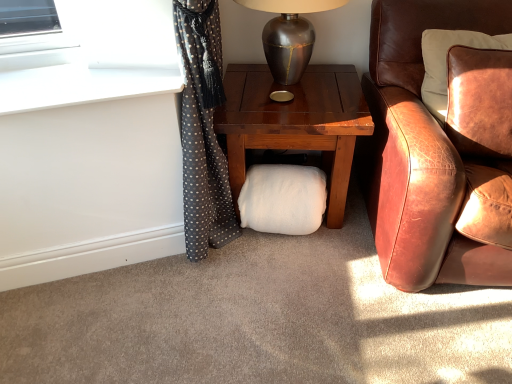
Where is `metallic silver table lamp at upper center`? The height and width of the screenshot is (384, 512). metallic silver table lamp at upper center is located at coordinates (289, 35).

This screenshot has height=384, width=512. What do you see at coordinates (283, 199) in the screenshot? I see `white fluffy pillow at center` at bounding box center [283, 199].

Image resolution: width=512 pixels, height=384 pixels. Identify the location of wooden nightstand at center. (295, 122).

The image size is (512, 384). Describe the element at coordinates (446, 62) in the screenshot. I see `leather pillow at right` at that location.

Locate an element on the screen. The height and width of the screenshot is (384, 512). white smooth window sill at upper left is located at coordinates (80, 86).

I want to click on metallic silver table lamp at upper center, so click(x=289, y=35).

Is wooden nightstand at center placed right next to brown leather chair at right?

No, wooden nightstand at center is not touching brown leather chair at right.

Can you confirm if wooden nightstand at center is bigger than brown leather chair at right?

No.

In the image, there is a brown leather chair at right. Identify the location of nightstand below it (from a real-world perspective). Image resolution: width=512 pixels, height=384 pixels. (295, 122).

Is wooden nightstand at center thinner than brown leather chair at right?

Yes.

Considering the positions of objects metallic silver table lamp at upper center and wooden nightstand at center in the image provided, who is more to the right, metallic silver table lamp at upper center or wooden nightstand at center?

From the viewer's perspective, wooden nightstand at center appears more on the right side.

Does metallic silver table lamp at upper center have a lesser height compared to wooden nightstand at center?

Correct, metallic silver table lamp at upper center is not as tall as wooden nightstand at center.

In the scene shown: Would you consider metallic silver table lamp at upper center to be distant from wooden nightstand at center?

They are positioned close to each other.

Does metallic silver table lamp at upper center have a larger size compared to wooden nightstand at center?

No, metallic silver table lamp at upper center is not bigger than wooden nightstand at center.

Looking at this image, is brown leather chair at right wider than leather pillow at right?

Correct, the width of brown leather chair at right exceeds that of leather pillow at right.

Does brown leather chair at right have a smaller size compared to leather pillow at right?

No, brown leather chair at right is not smaller than leather pillow at right.

Is brown leather chair at right aimed at leather pillow at right?

Yes, brown leather chair at right is facing leather pillow at right.

Is brown leather chair at right not close to leather pillow at right?

No, brown leather chair at right is in close proximity to leather pillow at right.

Which of these two, white smooth window sill at upper left or white fluffy pillow at center, is smaller?

white smooth window sill at upper left is smaller.

Is white smooth window sill at upper left looking in the opposite direction of white fluffy pillow at center?

white smooth window sill at upper left does not have its back to white fluffy pillow at center.

The width and height of the screenshot is (512, 384). What are the coordinates of `window sill on the left side of white fluffy pillow at center` in the screenshot? It's located at (80, 86).

How distant is white smooth window sill at upper left from white fluffy pillow at center?

white smooth window sill at upper left and white fluffy pillow at center are 26.64 inches apart.

From the image's perspective, does brown leather chair at right appear higher than metallic silver table lamp at upper center?

Incorrect, from the image's perspective, brown leather chair at right is lower than metallic silver table lamp at upper center.

Is brown leather chair at right next to metallic silver table lamp at upper center and touching it?

No.

Who is bigger, brown leather chair at right or metallic silver table lamp at upper center?

With larger size is brown leather chair at right.

Is brown leather chair at right not within metallic silver table lamp at upper center?

Yes, brown leather chair at right is not within metallic silver table lamp at upper center.

In terms of size, does white fluffy pillow at center appear bigger or smaller than brown leather chair at right?

Clearly, white fluffy pillow at center is smaller in size than brown leather chair at right.

From the picture: Is white fluffy pillow at center beside brown leather chair at right?

white fluffy pillow at center is not next to brown leather chair at right, and they're not touching.

Looking at this image, is white fluffy pillow at center thinner than brown leather chair at right?

Yes, white fluffy pillow at center is thinner than brown leather chair at right.

Between white fluffy pillow at center and brown leather chair at right, which one has more height?

brown leather chair at right is taller.

How many degrees apart are the facing directions of white fluffy pillow at center and metallic silver table lamp at upper center?

They differ by 0.672 degrees in their facing directions.

Which is closer, (x=266, y=184) or (x=282, y=57)?

Point (x=266, y=184) appears to be farther away from the viewer than point (x=282, y=57).

Would you say white fluffy pillow at center is to the left or to the right of metallic silver table lamp at upper center in the picture?

white fluffy pillow at center is positioned on metallic silver table lamp at upper center's left side.

From the image's perspective, is white fluffy pillow at center positioned above or below metallic silver table lamp at upper center?

white fluffy pillow at center is situated lower than metallic silver table lamp at upper center in the image.

Locate an element on the screen. nightstand directly beneath the brown leather chair at right (from a real-world perspective) is located at coordinates (295, 122).

Locate an element on the screen. The height and width of the screenshot is (384, 512). table lamp above the wooden nightstand at center (from a real-world perspective) is located at coordinates (289, 35).

Which object lies nearer to the anchor point wooden nightstand at center, metallic silver table lamp at upper center or white smooth window sill at upper left?

metallic silver table lamp at upper center lies closer to wooden nightstand at center than the other object.

Which object lies further to the anchor point wooden nightstand at center, white smooth window sill at upper left or metallic silver table lamp at upper center?

The object further to wooden nightstand at center is white smooth window sill at upper left.

Looking at the image, which one is located closer to brown leather chair at right, white fluffy pillow at center or white smooth window sill at upper left?

Based on the image, white fluffy pillow at center appears to be nearer to brown leather chair at right.

Estimate the real-world distances between objects in this image. Which object is closer to brown leather chair at right, white fluffy pillow at center or metallic silver table lamp at upper center?

white fluffy pillow at center is closer to brown leather chair at right.

When comparing their distances from leather pillow at right, does brown leather chair at right or metallic silver table lamp at upper center seem further?

metallic silver table lamp at upper center is further to leather pillow at right.

Considering their positions, is wooden nightstand at center positioned further to white fluffy pillow at center than white smooth window sill at upper left?

white smooth window sill at upper left is further to white fluffy pillow at center.

Based on the photo, when comparing their distances from leather pillow at right, does wooden nightstand at center or white fluffy pillow at center seem further?

white fluffy pillow at center is further to leather pillow at right.

Looking at the image, which one is located closer to leather pillow at right, white smooth window sill at upper left or brown leather chair at right?

brown leather chair at right.

Where is `nightstand between metallic silver table lamp at upper center and white fluffy pillow at center in the up-down direction`? The height and width of the screenshot is (384, 512). nightstand between metallic silver table lamp at upper center and white fluffy pillow at center in the up-down direction is located at coordinates (295, 122).

You are a GUI agent. You are given a task and a screenshot of the screen. Output one action in this format:
    pyautogui.click(x=<x>, y=<y>)
    Task: Click on the table lamp between white fluffy pillow at center and leather pillow at right in the horizontal direction
    
    Given the screenshot: What is the action you would take?
    pyautogui.click(x=289, y=35)

Identify the location of pillow between white smooth window sill at upper left and brown leather chair at right. The height and width of the screenshot is (384, 512). (446, 62).

At what (x,y) coordinates should I click in order to perform the action: click on material between white smooth window sill at upper left and leather pillow at right from left to right. Please return your answer as a coordinate pair (x, y). Image resolution: width=512 pixels, height=384 pixels. Looking at the image, I should click on (283, 199).